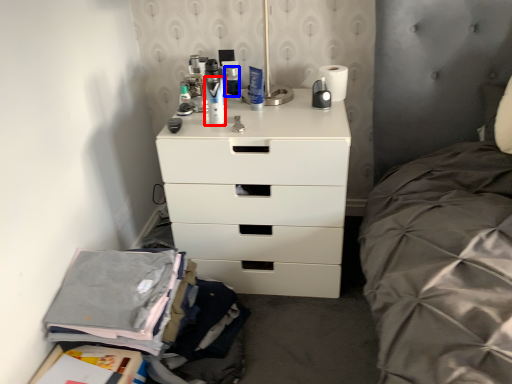
Question: Which object appears farthest to the camera in this image, toiletry (highlighted by a red box) or toiletry (highlighted by a blue box)?

Choices:
 (A) toiletry
 (B) toiletry

Answer: (B)